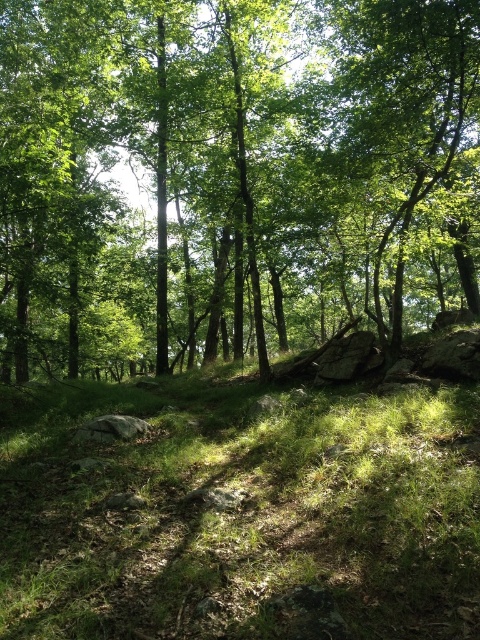
Is point (412, 214) positioned after point (467, 552)?

Yes, it is.

Between point (84, 252) and point (463, 531), which one is positioned behind?

Positioned behind is point (84, 252).

Locate an element on the screen. green leafy tree at center is located at coordinates (232, 176).